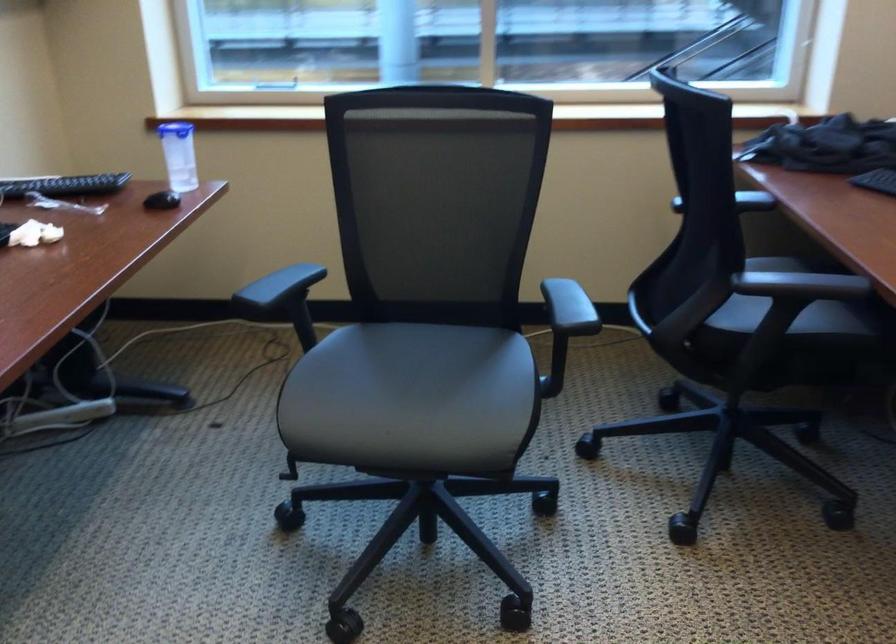
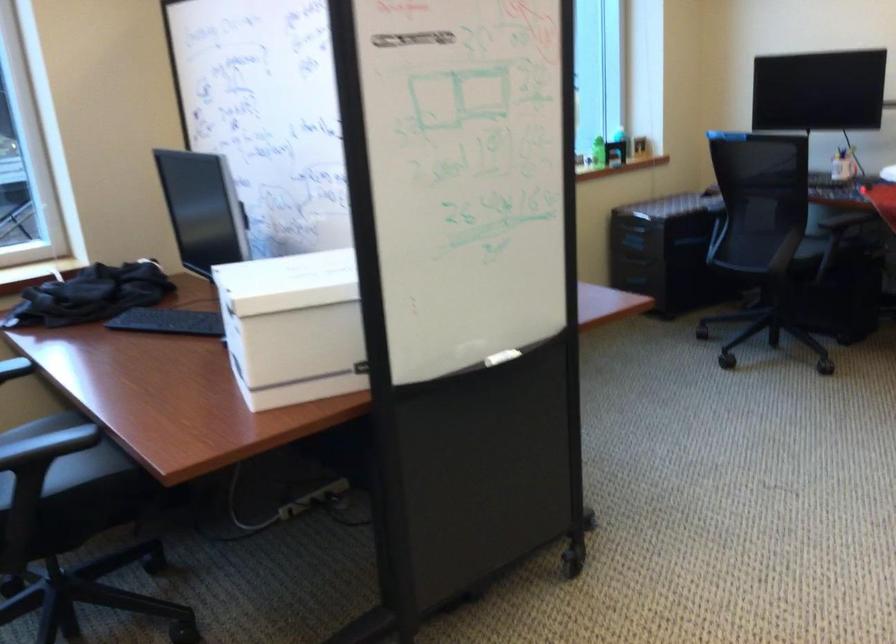
Where in the second image is the point corresponding to point 790,308 from the first image?

(65, 464)